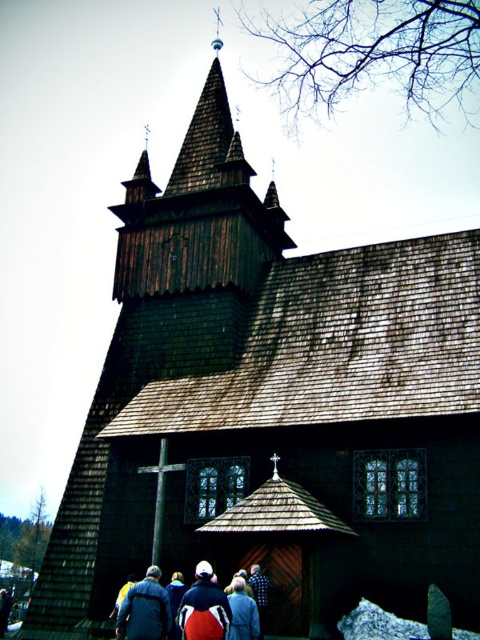
Question: From the image, what is the correct spatial relationship of red jacket at center in relation to blue fabric jacket at lower center?

Choices:
 (A) left
 (B) right

Answer: (A)

Question: Does dark blue jacket at lower center appear on the right side of dark blue jacket at lower left?

Choices:
 (A) yes
 (B) no

Answer: (A)

Question: Estimate the real-world distances between objects in this image. Which object is farther from the dark blue jacket at lower left?

Choices:
 (A) blue fabric jacket at lower center
 (B) red jacket at center
 (C) dark blue jacket at lower center

Answer: (A)

Question: Among these points, which one is farthest from the camera?

Choices:
 (A) (228, 628)
 (B) (191, 618)

Answer: (B)

Question: Which point appears farthest from the camera in this image?

Choices:
 (A) (252, 636)
 (B) (165, 625)

Answer: (B)

Question: Is dark blue jacket at lower left above blue fabric jacket at lower center?

Choices:
 (A) yes
 (B) no

Answer: (B)